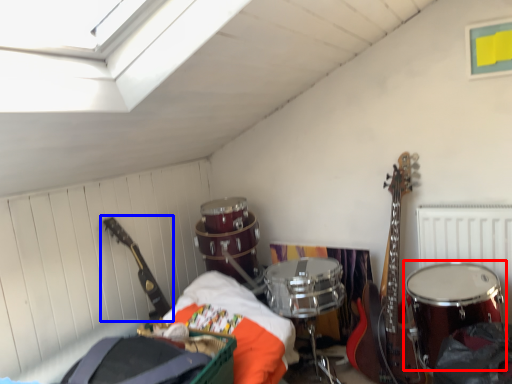
Question: Which point is closer to the camera, drum (highlighted by a red box) or guitar (highlighted by a blue box)?

Choices:
 (A) drum
 (B) guitar

Answer: (A)